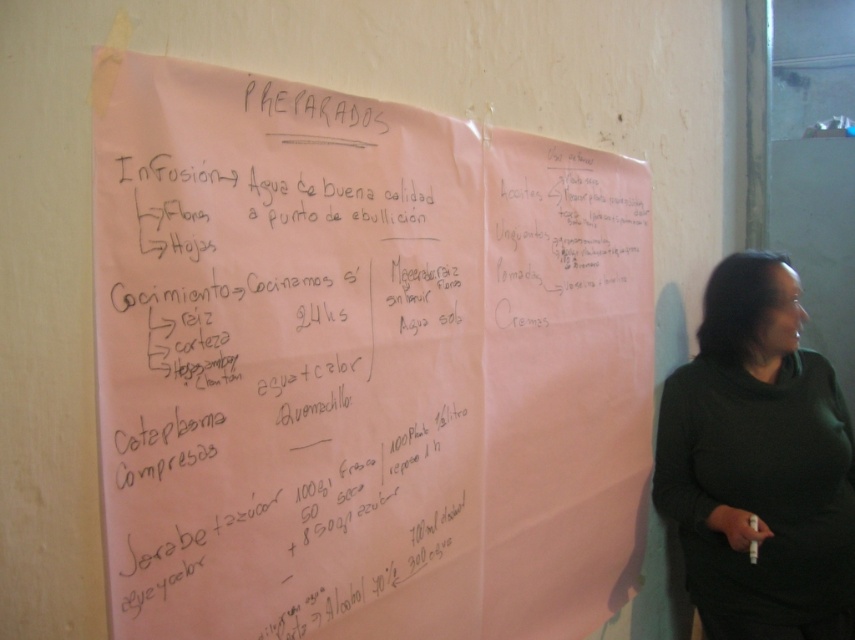
I want to click on pink paper at upper center, so click(363, 365).

Is pink paper at upper center below black sweater at right?

No.

Describe the element at coordinates (363, 365) in the screenshot. This screenshot has height=640, width=855. I see `pink paper at upper center` at that location.

Image resolution: width=855 pixels, height=640 pixels. I want to click on pink paper at upper center, so click(x=363, y=365).